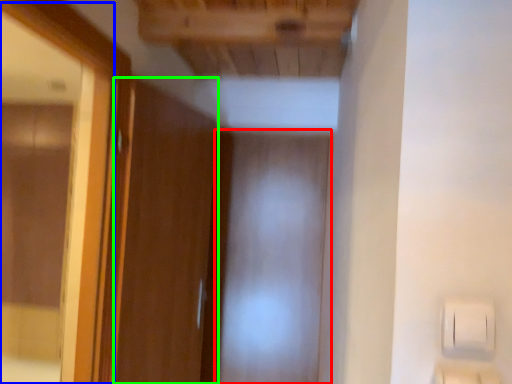
Question: Based on their relative distances, which object is nearer to screen door (highlighted by a red box)? Choose from mirror (highlighted by a blue box) and door (highlighted by a green box).

Choices:
 (A) mirror
 (B) door

Answer: (B)